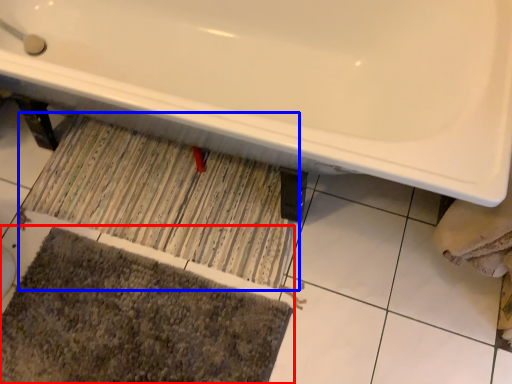
Question: Which object appears closest to the camera in this image, bath mat (highlighted by a red box) or doormat (highlighted by a blue box)?

Choices:
 (A) bath mat
 (B) doormat

Answer: (A)